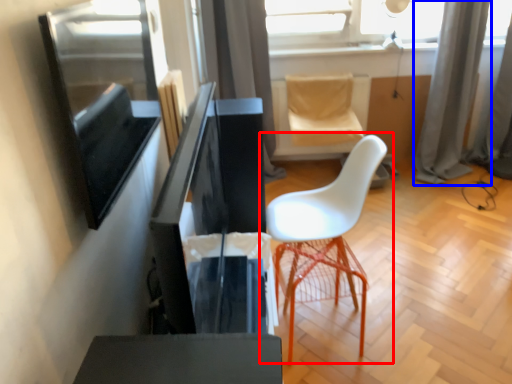
Question: Among these objects, which one is farthest to the camera, chair (highlighted by a red box) or curtain (highlighted by a blue box)?

Choices:
 (A) chair
 (B) curtain

Answer: (B)